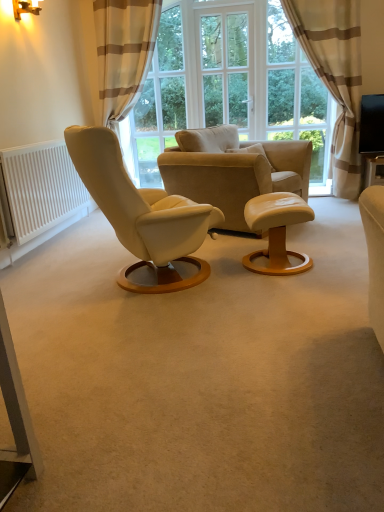
Locate an element on the screen. spots to the right of white matte radiator at left is located at coordinates 91,237.